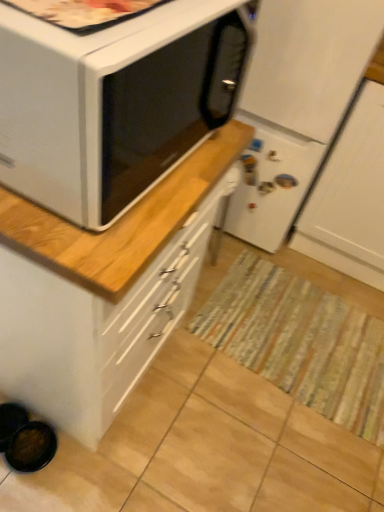
Question: From the image's perspective, is white matte microwave oven at upper left located above or below white glossy cabinet at upper left?

Choices:
 (A) below
 (B) above

Answer: (B)

Question: Does point (23, 194) appear closer or farther from the camera than point (69, 321)?

Choices:
 (A) farther
 (B) closer

Answer: (B)

Question: Which of these objects is positioned closest to the white matte microwave oven at upper left?

Choices:
 (A) white matte refrigerator at center
 (B) striped fabric mat at center
 (C) white glossy cabinet at upper left

Answer: (A)

Question: Which is farther from the striped fabric mat at center?

Choices:
 (A) white glossy cabinet at upper left
 (B) white matte microwave oven at upper left
 (C) white matte refrigerator at center

Answer: (B)